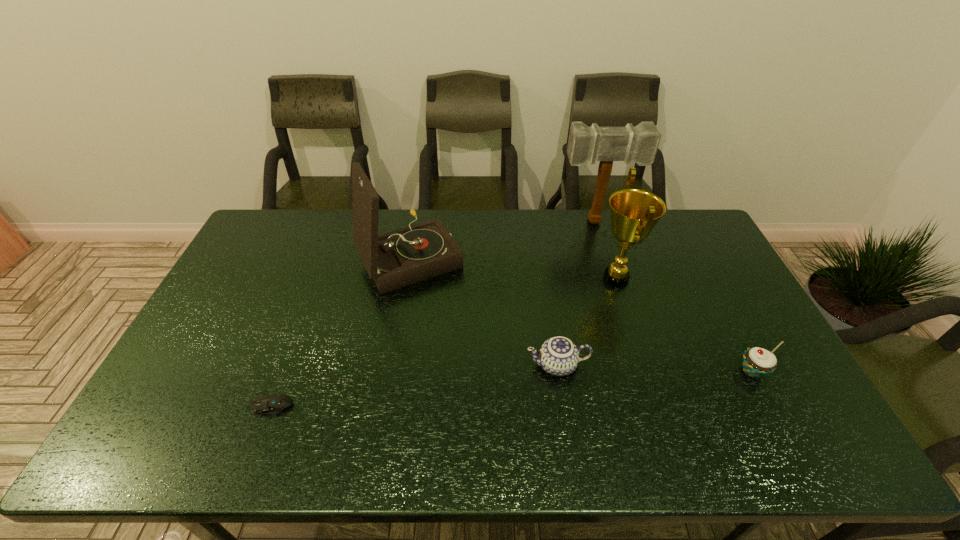
Locate an element on the screen. Image resolution: width=960 pixels, height=540 pixels. mallet is located at coordinates (639, 144).

This screenshot has width=960, height=540. In order to click on phonograph record in this screenshot , I will do `click(396, 259)`.

Image resolution: width=960 pixels, height=540 pixels. Find the location of `award`. award is located at coordinates (634, 213).

The image size is (960, 540). What are the coordinates of `cupcake` in the screenshot? It's located at (757, 362).

Find the location of a particular element. The width and height of the screenshot is (960, 540). chinaware is located at coordinates (559, 356).

At what (x,y) coordinates should I click in order to perform the action: click on the nearest object. Please return your answer as a coordinate pair (x, y). Looking at the image, I should click on [272, 403].

Where is `the leftmost object`? The width and height of the screenshot is (960, 540). the leftmost object is located at coordinates (272, 403).

The width and height of the screenshot is (960, 540). In order to click on blank space located on the right of the mallet in this screenshot , I will do `click(699, 221)`.

The width and height of the screenshot is (960, 540). I want to click on free region located on the left of the phonograph record, so click(341, 257).

Locate an element on the screen. The image size is (960, 540). vacant space situated 0.220m on the front view with handles of the award is located at coordinates (525, 279).